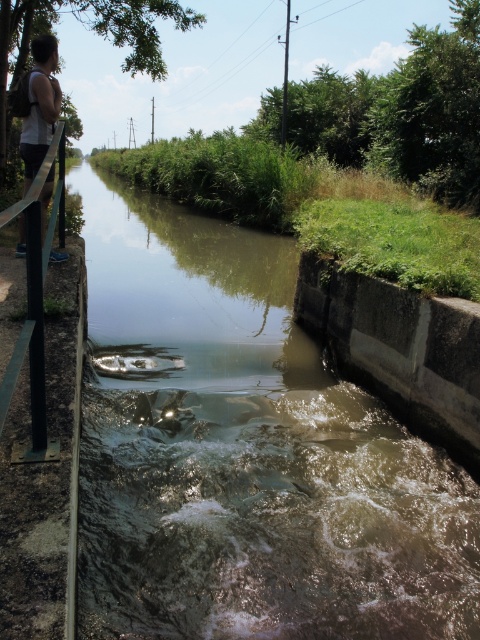
Question: Can you confirm if brown murky water at center is positioned to the left of white fabric at left?

Choices:
 (A) yes
 (B) no

Answer: (B)

Question: Is brown murky water at center closer to the viewer compared to white fabric at left?

Choices:
 (A) no
 (B) yes

Answer: (B)

Question: Can you confirm if brown murky water at center is positioned to the left of white fabric at left?

Choices:
 (A) yes
 (B) no

Answer: (B)

Question: Among these objects, which one is farthest from the camera?

Choices:
 (A) brown murky water at center
 (B) white fabric at left

Answer: (B)

Question: Which point appears farthest from the camera in this image?

Choices:
 (A) (26, 188)
 (B) (142, 352)

Answer: (B)

Question: Which object is farther from the camera taking this photo?

Choices:
 (A) brown murky water at center
 (B) white fabric at left

Answer: (B)